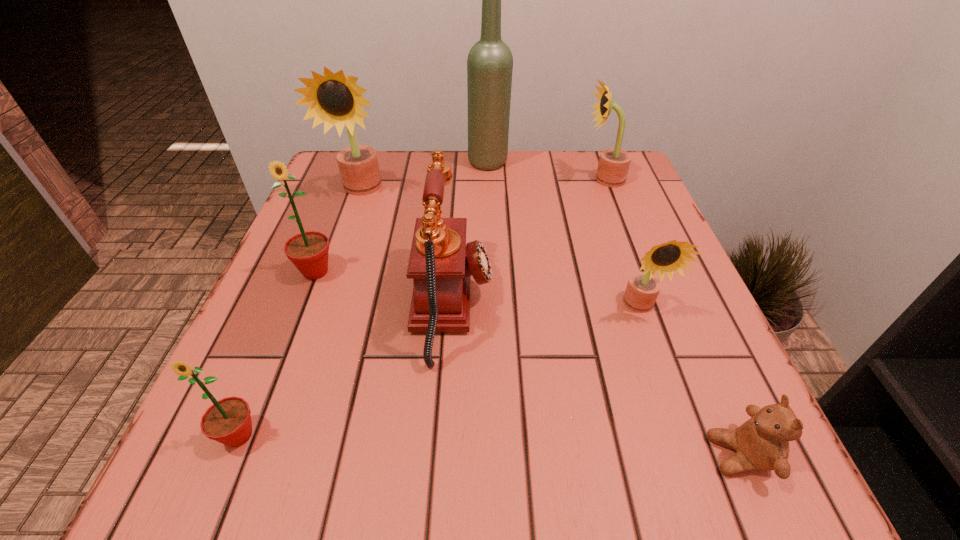
Identify the location of vacant space that is in between the biggest yellow sunflower and the farther green sunflower. (339, 231).

Where is `vacant space in between the farther green sunflower and the smaller green sunflower`? vacant space in between the farther green sunflower and the smaller green sunflower is located at coordinates (277, 354).

You are a GUI agent. You are given a task and a screenshot of the screen. Output one action in this format:
    pyautogui.click(x=<x>, y=<y>)
    Task: Click on the free area in between the second tallest object and the telephone
    This screenshot has width=960, height=540.
    Given the screenshot: What is the action you would take?
    pyautogui.click(x=407, y=248)

Image resolution: width=960 pixels, height=540 pixels. What are the coordinates of `vacant space that's between the telephone and the biggest yellow sunflower` in the screenshot? It's located at (407, 248).

The height and width of the screenshot is (540, 960). Find the location of `free space between the brown teddy bear and the second smallest yellow sunflower`. free space between the brown teddy bear and the second smallest yellow sunflower is located at coordinates (672, 317).

The height and width of the screenshot is (540, 960). Identify the location of free point between the seventh shortest object and the shortest object. (550, 322).

This screenshot has height=540, width=960. In order to click on free space between the teddy bear and the wine bottle in this screenshot , I will do `click(613, 308)`.

The image size is (960, 540). In order to click on free space that is in between the nearest sunflower and the bigger green sunflower in this screenshot , I will do `click(277, 354)`.

Image resolution: width=960 pixels, height=540 pixels. Identify the location of empty location between the telephone and the bigger green sunflower. (384, 289).

Where is `free spot between the tallest object and the nearer green sunflower`? The width and height of the screenshot is (960, 540). free spot between the tallest object and the nearer green sunflower is located at coordinates (364, 299).